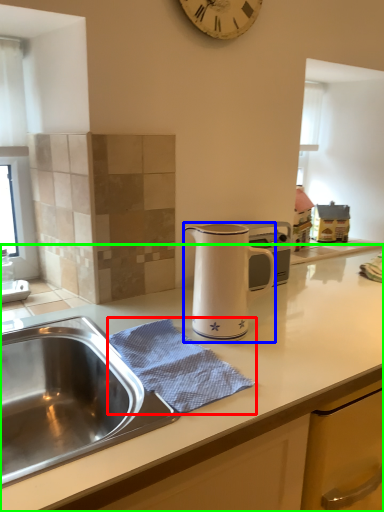
Question: Which is farther away from blanket (highlighted by a red box)? jug (highlighted by a blue box) or countertop (highlighted by a green box)?

Choices:
 (A) jug
 (B) countertop

Answer: (A)